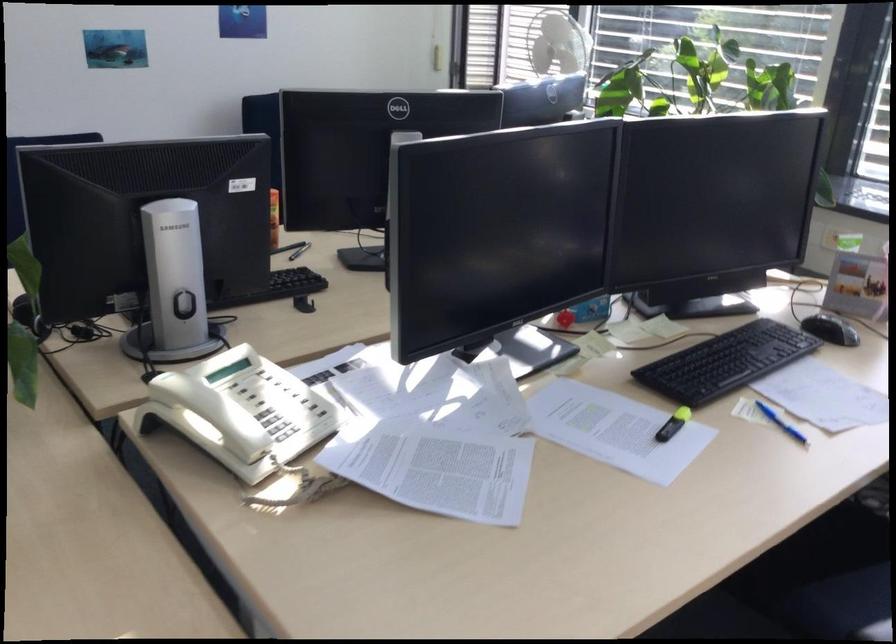
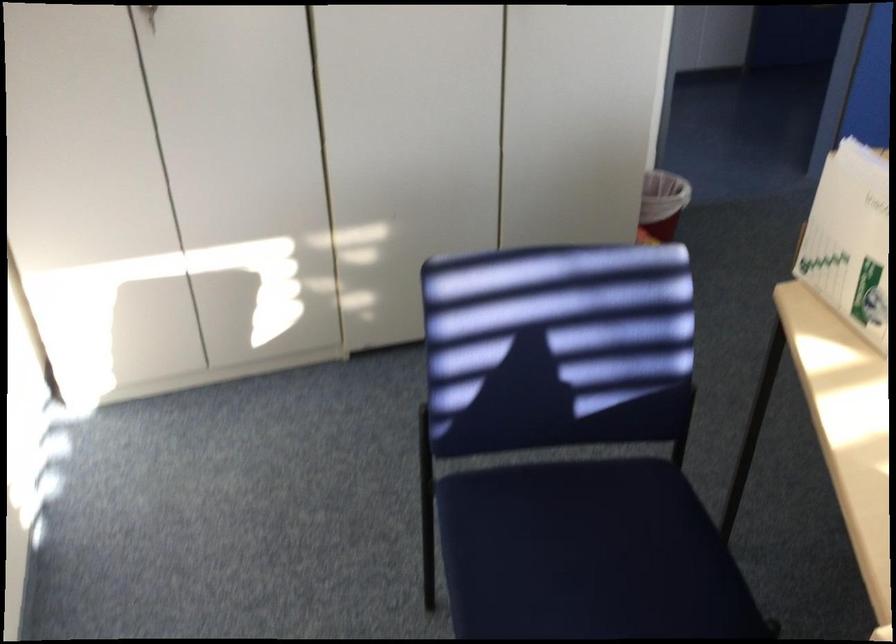
The first image is from the beginning of the video and the second image is from the end. How did the camera likely rotate when shooting the video?

The camera's rotation is toward left-down.